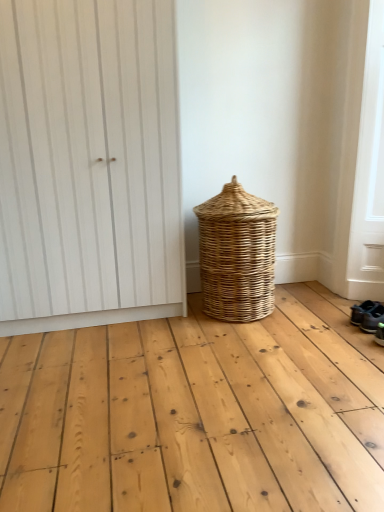
Question: Does white wood door at upper left have a greater height compared to dark gray fabric shoe at lower right, marked as the second footwear in a back-to-front arrangement?

Choices:
 (A) yes
 (B) no

Answer: (A)

Question: From the image's perspective, is white wood door at upper left under dark gray fabric shoe at lower right, marked as the second footwear in a back-to-front arrangement?

Choices:
 (A) yes
 (B) no

Answer: (B)

Question: From the image's perspective, is white wood door at upper left on top of dark gray fabric shoe at lower right, the first footwear from the front?

Choices:
 (A) no
 (B) yes

Answer: (B)

Question: Does white wood door at upper left have a lesser width compared to dark gray fabric shoe at lower right, the first footwear from the front?

Choices:
 (A) yes
 (B) no

Answer: (B)

Question: Can you confirm if white wood door at upper left is positioned to the right of dark gray fabric shoe at lower right, the first footwear from the front?

Choices:
 (A) yes
 (B) no

Answer: (B)

Question: Does point (29, 279) appear closer or farther from the camera than point (226, 221)?

Choices:
 (A) closer
 (B) farther

Answer: (B)

Question: Looking at the image, does white wood door at upper left seem bigger or smaller compared to woven natural basket at center?

Choices:
 (A) big
 (B) small

Answer: (A)

Question: Considering the positions of white wood door at upper left and woven natural basket at center in the image, is white wood door at upper left wider or thinner than woven natural basket at center?

Choices:
 (A) wide
 (B) thin

Answer: (B)

Question: From the image's perspective, is white wood door at upper left located above or below woven natural basket at center?

Choices:
 (A) below
 (B) above

Answer: (B)

Question: Does point (233, 245) appear closer or farther from the camera than point (370, 322)?

Choices:
 (A) closer
 (B) farther

Answer: (B)

Question: Considering their positions, is woven natural basket at center located in front of or behind dark gray fabric shoe at lower right, the first footwear from the front?

Choices:
 (A) behind
 (B) front

Answer: (A)

Question: In terms of width, does woven natural basket at center look wider or thinner when compared to dark gray fabric shoe at lower right, the first footwear from the front?

Choices:
 (A) thin
 (B) wide

Answer: (B)

Question: Looking at the image, does woven natural basket at center seem bigger or smaller compared to dark gray fabric shoe at lower right, the first footwear from the front?

Choices:
 (A) small
 (B) big

Answer: (B)

Question: In terms of height, does dark gray fabric shoe at lower right, marked as the second footwear in a back-to-front arrangement, look taller or shorter compared to white wood door at upper left?

Choices:
 (A) short
 (B) tall

Answer: (A)

Question: Relative to white wood door at upper left, is dark gray fabric shoe at lower right, the first footwear from the front, in front or behind?

Choices:
 (A) front
 (B) behind

Answer: (B)